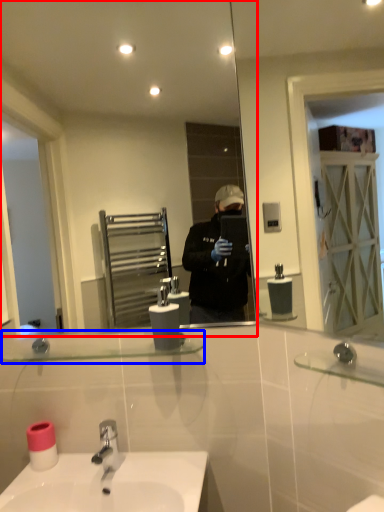
Question: Which object is closer to the camera taking this photo, mirror (highlighted by a red box) or balustrade (highlighted by a blue box)?

Choices:
 (A) mirror
 (B) balustrade

Answer: (B)